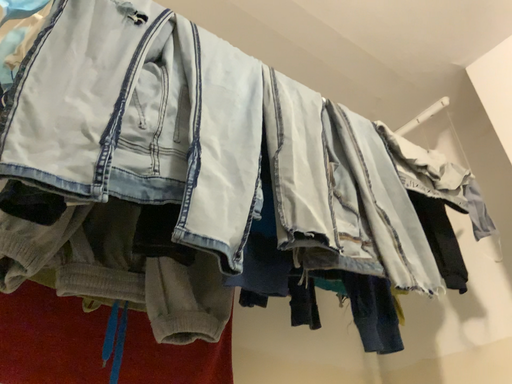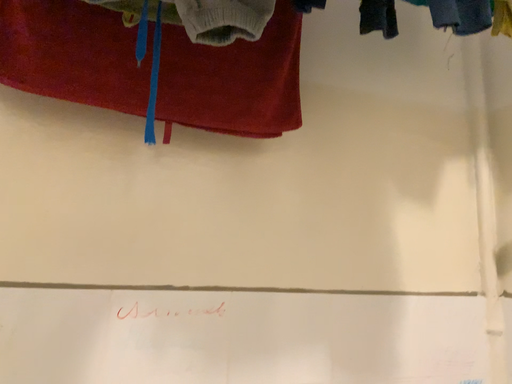
Question: How did the camera likely rotate when shooting the video?

Choices:
 (A) rotated left
 (B) rotated right

Answer: (A)